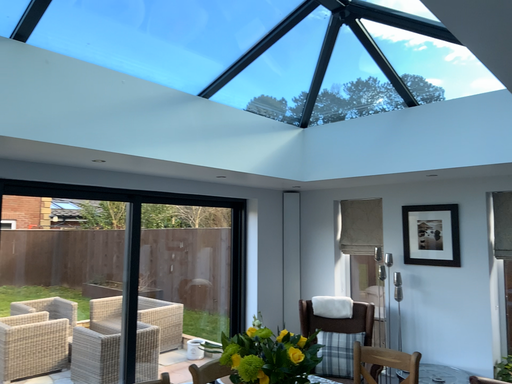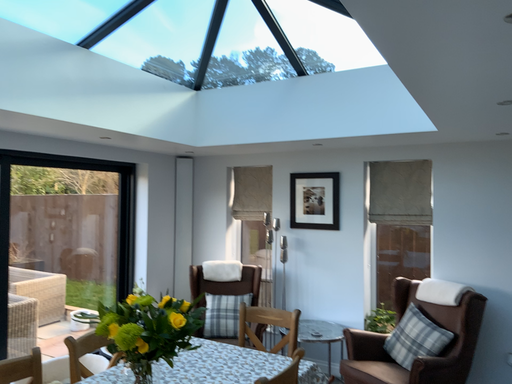
Question: How did the camera likely rotate when shooting the video?

Choices:
 (A) rotated right
 (B) rotated left

Answer: (A)